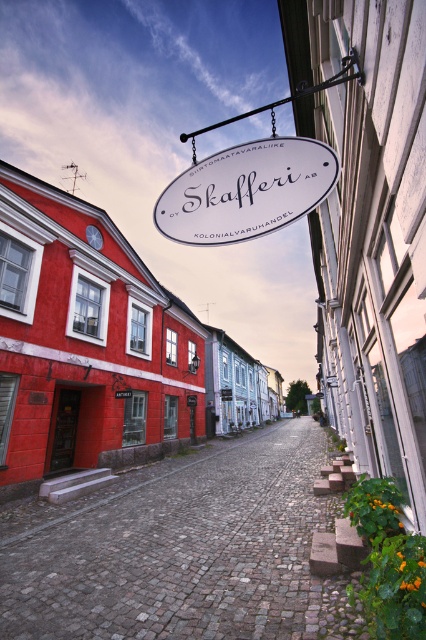
Who is lower down, white oval sign at upper center or white oval sign at center?

white oval sign at upper center

Which is more to the right, white oval sign at upper center or white oval sign at center?

From the viewer's perspective, white oval sign at upper center appears more on the right side.

Measure the distance between point (48, 394) and camera.

9.42 meters

This screenshot has width=426, height=640. In order to click on white oval sign at upper center in this screenshot , I will do `click(86, 342)`.

The width and height of the screenshot is (426, 640). What do you see at coordinates (183, 548) in the screenshot? I see `cobblestone alley at center` at bounding box center [183, 548].

Is cobblestone alley at center below white oval sign at center?

Indeed, cobblestone alley at center is positioned under white oval sign at center.

Measure the distance between cobblestone alley at center and camera.

cobblestone alley at center and camera are 3.07 meters apart.

Find the location of a particular element. cobblestone alley at center is located at coordinates (183, 548).

Between cobblestone alley at center and white oval sign at upper center, which one has less height?

Standing shorter between the two is cobblestone alley at center.

Does cobblestone alley at center appear on the right side of white oval sign at upper center?

In fact, cobblestone alley at center is to the left of white oval sign at upper center.

Which is behind, point (310, 481) or point (40, 282)?

The point (310, 481) is behind.

This screenshot has height=640, width=426. Find the location of `cobblestone alley at center`. cobblestone alley at center is located at coordinates (183, 548).